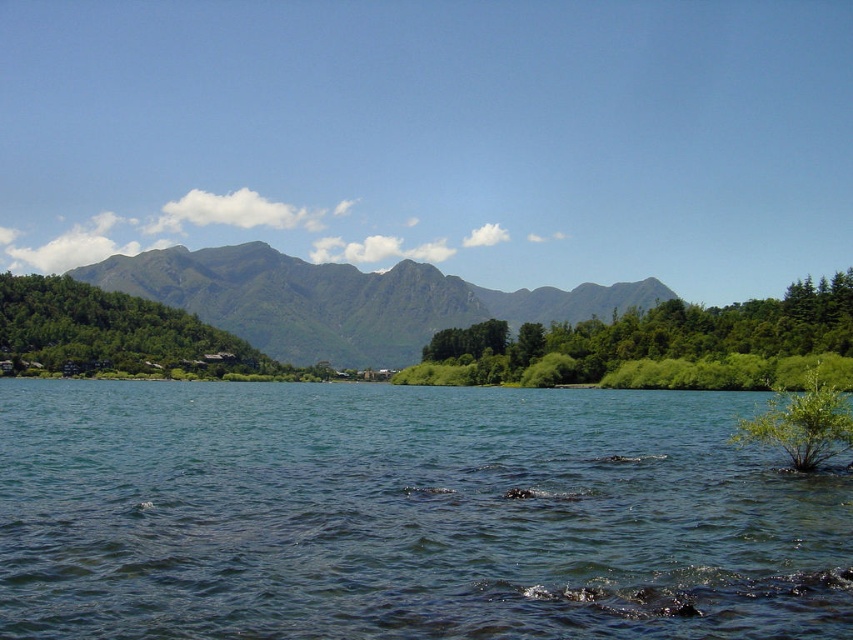
Is clear blue water at center positioned at the back of green textured mountain at center?

That is False.

Between clear blue water at center and green textured mountain at center, which one is positioned higher?

green textured mountain at center is higher up.

Where is `clear blue water at center`? clear blue water at center is located at coordinates (407, 515).

Based on the photo, who is more forward, (340, 289) or (300, 376)?

Point (300, 376)

In order to click on green textured mountain at center in this screenshot , I will do `click(343, 300)`.

How much distance is there between clear blue water at center and green leafy trees at center?

clear blue water at center and green leafy trees at center are 51.89 meters apart.

Is clear blue water at center taller than green leafy trees at center?

No.

Measure the distance between clear blue water at center and camera.

clear blue water at center is 15.31 meters away from camera.

The image size is (853, 640). What are the coordinates of `clear blue water at center` in the screenshot? It's located at (407, 515).